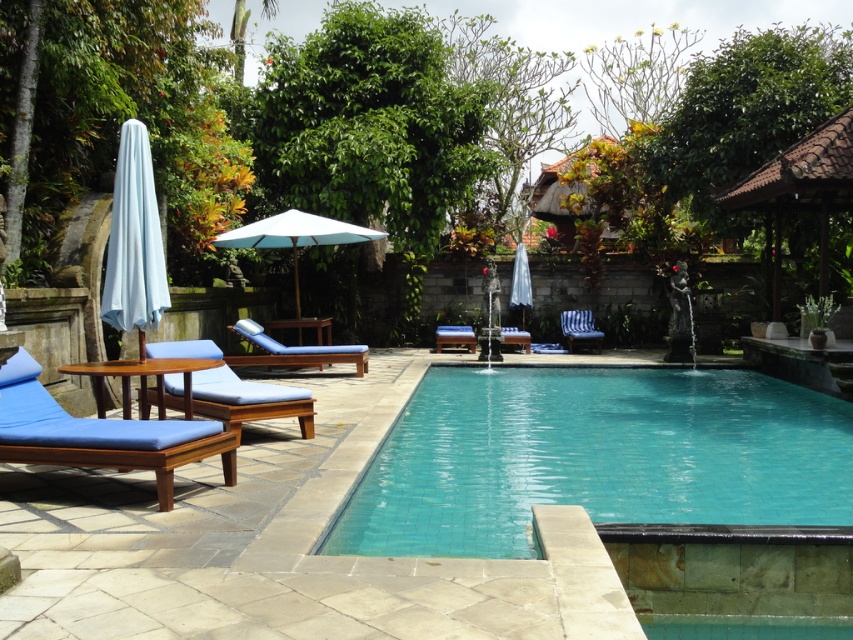
You are standing at the edge of the teal tile swimming pool at center and want to reach the blue wood chaise lounge at center. Which direction should you move to get there?

The teal tile swimming pool at center is closer to the viewer than the blue wood chaise lounge at center, so you should move backward to reach the blue wood chaise lounge at center.

You are planning to place a new small potted plant between the white fabric umbrella at left and the blue fabric lounge chair at left. Based on their positions, will the plant be under the umbrella?

The white fabric umbrella at left is positioned over the blue fabric lounge chair at left, so placing the plant between them would place it under the umbrella as well.